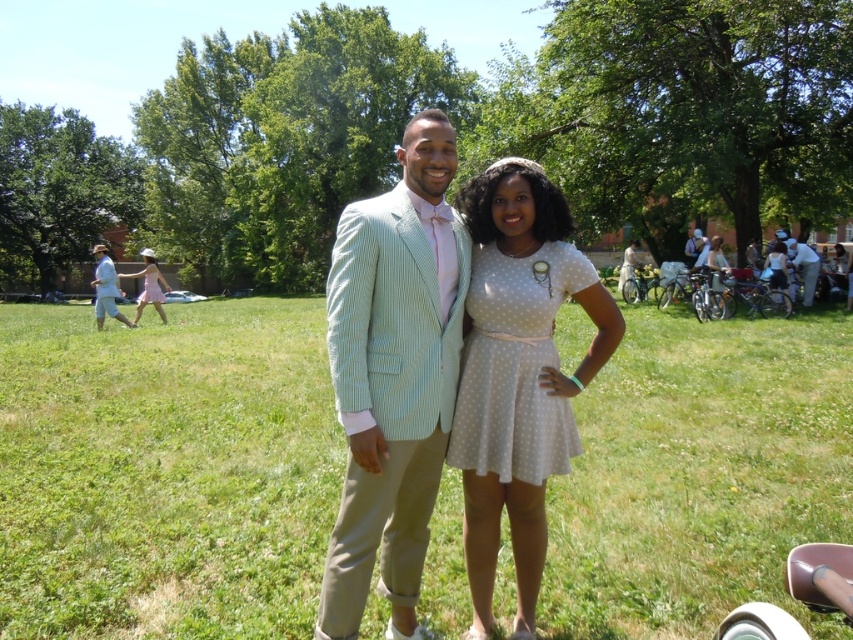
Is white dotted dress at center to the left of pink polka dot dress at center from the viewer's perspective?

Incorrect, white dotted dress at center is not on the left side of pink polka dot dress at center.

Does white dotted dress at center appear under pink polka dot dress at center?

Yes.

Which is behind, point (474, 637) or point (143, 289)?

Positioned behind is point (143, 289).

This screenshot has width=853, height=640. I want to click on white dotted dress at center, so click(x=518, y=374).

Does seersucker suit at center appear on the left side of light pink fabric dress at left?

Incorrect, seersucker suit at center is not on the left side of light pink fabric dress at left.

Can you confirm if seersucker suit at center is shorter than light pink fabric dress at left?

Correct, seersucker suit at center is not as tall as light pink fabric dress at left.

Which is behind, point (364, 310) or point (154, 262)?

Positioned behind is point (154, 262).

At what (x,y) coordinates should I click in order to perform the action: click on seersucker suit at center. Please return your answer as a coordinate pair (x, y). Image resolution: width=853 pixels, height=640 pixels. Looking at the image, I should click on (393, 376).

Between seersucker suit at center and white dotted dress at center, which one has more height?

white dotted dress at center is taller.

Is seersucker suit at center smaller than white dotted dress at center?

Correct, seersucker suit at center occupies less space than white dotted dress at center.

Which is behind, point (421, 500) or point (495, 204)?

The point (495, 204) is behind.

Locate an element on the screen. This screenshot has height=640, width=853. seersucker suit at center is located at coordinates (393, 376).